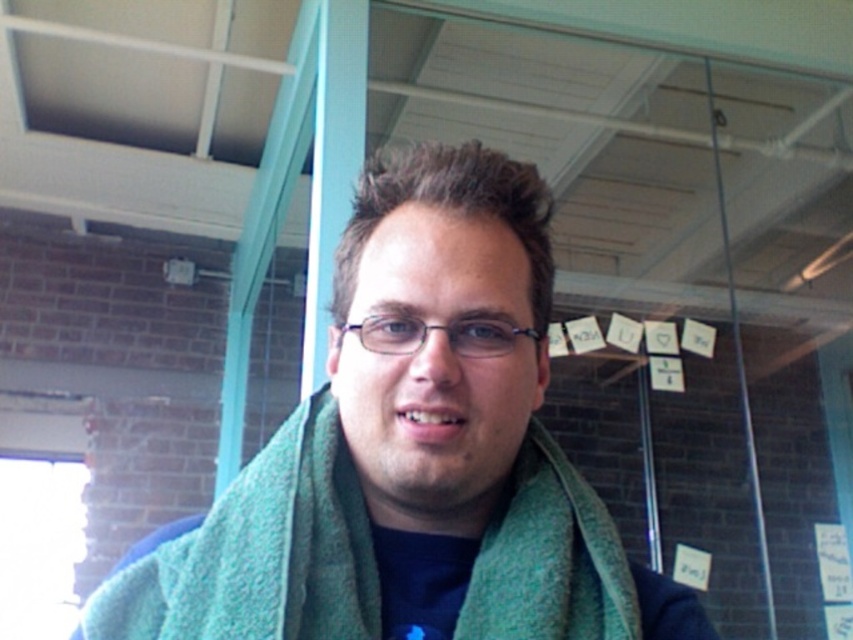
Is green wool scarf at center positioned behind green woolen scarf at center?

No, green wool scarf at center is closer to the viewer.

Is green wool scarf at center positioned in front of green woolen scarf at center?

Yes, it is.

Is point (538, 595) more distant than point (189, 573)?

No, (538, 595) is in front of (189, 573).

Identify the location of green wool scarf at center. (412, 452).